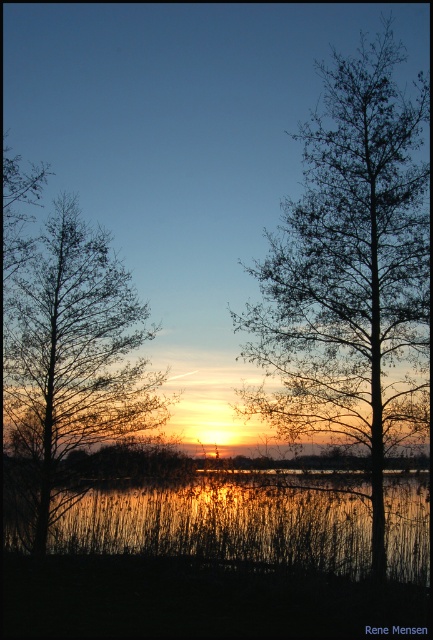
You are an artist sketching the sunset scene. You notice the bare branches at center and the silhouette bare tree at left. Which object is positioned lower in the image?

The bare branches at center is located below the silhouette bare tree at left, so it is positioned lower in the image.

You are an artist trying to paint the sunset scene. You notice the bare branches at center and the reflective glass water at center. Which object should you paint first if you want to follow the rule of painting taller objects before shorter ones?

You should paint the bare branches at center first because it has a greater height compared to the reflective glass water at center, following the rule of painting taller objects before shorter ones.